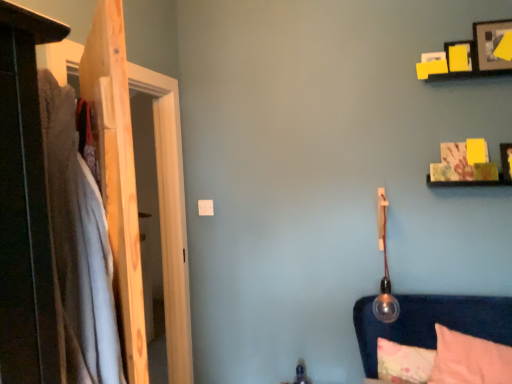
Question: Could yellow paper picture frame at upper right, the second picture frame when ordered from bottom to top, be considered to be inside wooden door at left?

Choices:
 (A) yes
 (B) no

Answer: (B)

Question: Does wooden door at left turn towards yellow paper picture frame at upper right, marked as the second picture frame in a top-to-bottom arrangement?

Choices:
 (A) yes
 (B) no

Answer: (A)

Question: Can we say wooden door at left lies outside yellow paper picture frame at upper right, the second picture frame when ordered from bottom to top?

Choices:
 (A) no
 (B) yes

Answer: (B)

Question: Does wooden door at left have a greater height compared to yellow paper picture frame at upper right, the second picture frame when ordered from bottom to top?

Choices:
 (A) yes
 (B) no

Answer: (A)

Question: Is wooden door at left at the left side of yellow paper picture frame at upper right, marked as the second picture frame in a top-to-bottom arrangement?

Choices:
 (A) no
 (B) yes

Answer: (B)

Question: Can you confirm if wooden door at left is positioned to the right of yellow paper picture frame at upper right, marked as the second picture frame in a top-to-bottom arrangement?

Choices:
 (A) yes
 (B) no

Answer: (B)

Question: Is wooden picture frame at upper right, the 1th picture frame when ordered from top to bottom, directly adjacent to yellow paper picture frame at upper right, marked as the second picture frame in a top-to-bottom arrangement?

Choices:
 (A) no
 (B) yes

Answer: (B)

Question: Can you confirm if wooden picture frame at upper right, the 1th picture frame when ordered from top to bottom, is smaller than yellow paper picture frame at upper right, the second picture frame when ordered from bottom to top?

Choices:
 (A) no
 (B) yes

Answer: (A)

Question: Can we say wooden picture frame at upper right, the third picture frame ordered from the bottom, lies outside yellow paper picture frame at upper right, the second picture frame when ordered from bottom to top?

Choices:
 (A) yes
 (B) no

Answer: (A)

Question: Can you confirm if wooden picture frame at upper right, the 1th picture frame when ordered from top to bottom, is bigger than yellow paper picture frame at upper right, marked as the second picture frame in a top-to-bottom arrangement?

Choices:
 (A) yes
 (B) no

Answer: (A)

Question: From the image's perspective, does wooden picture frame at upper right, the 1th picture frame when ordered from top to bottom, appear lower than yellow paper picture frame at upper right, the second picture frame when ordered from bottom to top?

Choices:
 (A) yes
 (B) no

Answer: (B)

Question: Is wooden picture frame at upper right, the third picture frame ordered from the bottom, positioned in front of yellow paper picture frame at upper right, marked as the second picture frame in a top-to-bottom arrangement?

Choices:
 (A) no
 (B) yes

Answer: (B)

Question: Is wooden door at left positioned behind wooden picture frame at upper right, the 1th picture frame when ordered from top to bottom?

Choices:
 (A) yes
 (B) no

Answer: (B)